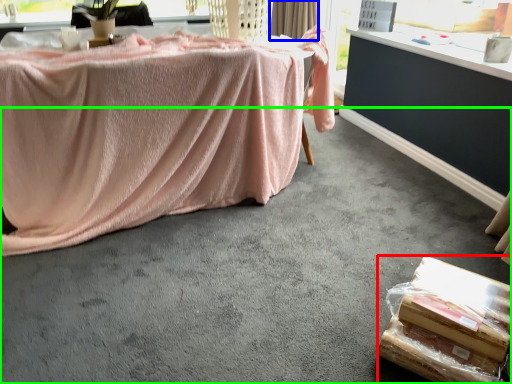
Question: Which is nearer to the food (highlighted by a red box)? curtain (highlighted by a blue box) or concrete (highlighted by a green box).

Choices:
 (A) curtain
 (B) concrete

Answer: (B)